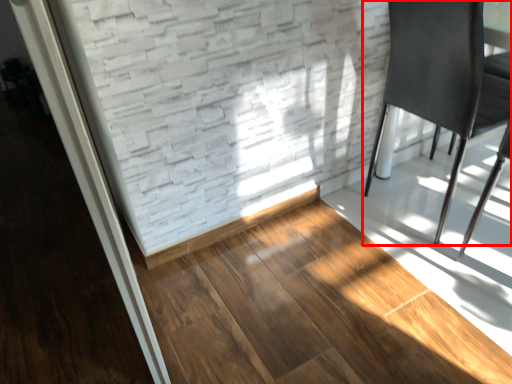
Question: Observing the image, what is the correct spatial positioning of chair (annotated by the red box) in reference to hardwood?

Choices:
 (A) right
 (B) left

Answer: (A)